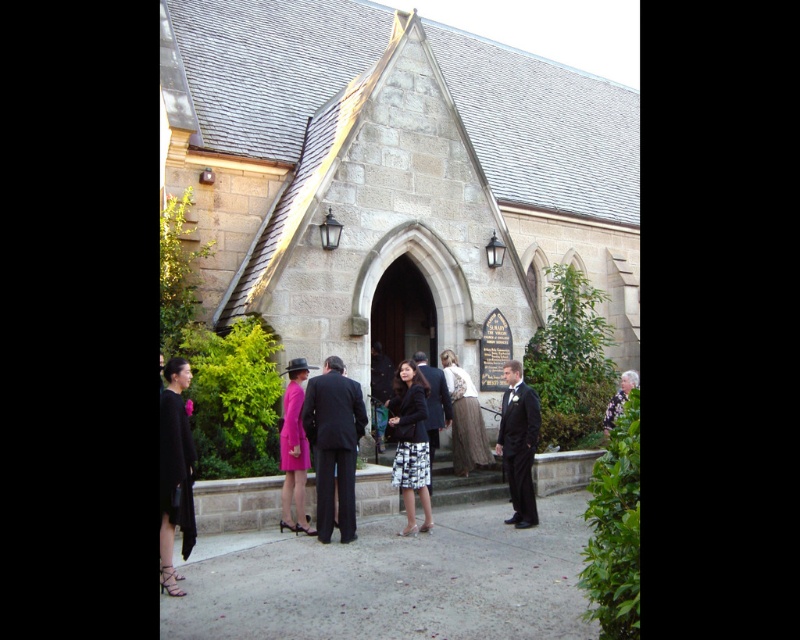
Does black suit at center appear on the left side of floral-patterned shirt at center?

Indeed, black suit at center is positioned on the left side of floral-patterned shirt at center.

Between point (428, 448) and point (612, 404), which one is positioned behind?

The point (612, 404) is behind.

Where is `black suit at center`? black suit at center is located at coordinates (434, 404).

Between black satin dress at lower left and floral-patterned shirt at center, which one has more height?

With more height is floral-patterned shirt at center.

Does black satin dress at lower left have a smaller size compared to floral-patterned shirt at center?

Indeed, black satin dress at lower left has a smaller size compared to floral-patterned shirt at center.

Is point (182, 444) closer to camera compared to point (630, 372)?

That is True.

Where is `black satin dress at lower left`? Image resolution: width=800 pixels, height=640 pixels. black satin dress at lower left is located at coordinates (174, 472).

Find the location of a particular element. black satin dress at lower left is located at coordinates (174, 472).

Is point (170, 572) positioned before point (280, 518)?

Yes, point (170, 572) is closer to viewer.

Describe the element at coordinates (174, 472) in the screenshot. I see `black satin dress at lower left` at that location.

The image size is (800, 640). I want to click on black satin dress at lower left, so click(174, 472).